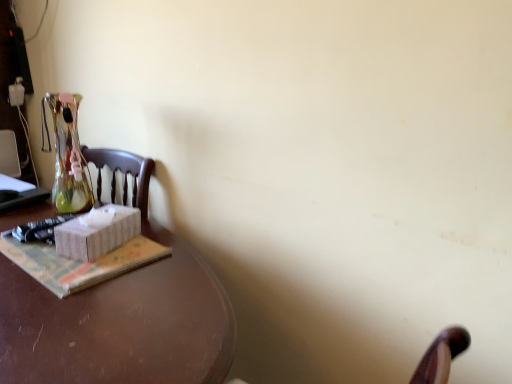
Locate an element on the screen. The height and width of the screenshot is (384, 512). free location to the right of white paper at left is located at coordinates (175, 274).